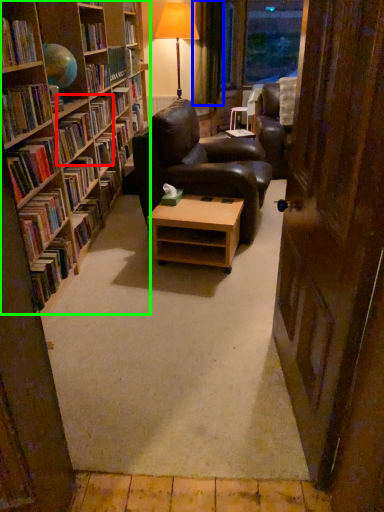
Question: Estimate the real-world distances between objects in this image. Which object is farther from book (highlighted by a red box), curtain (highlighted by a blue box) or bookcase (highlighted by a green box)?

Choices:
 (A) curtain
 (B) bookcase

Answer: (A)